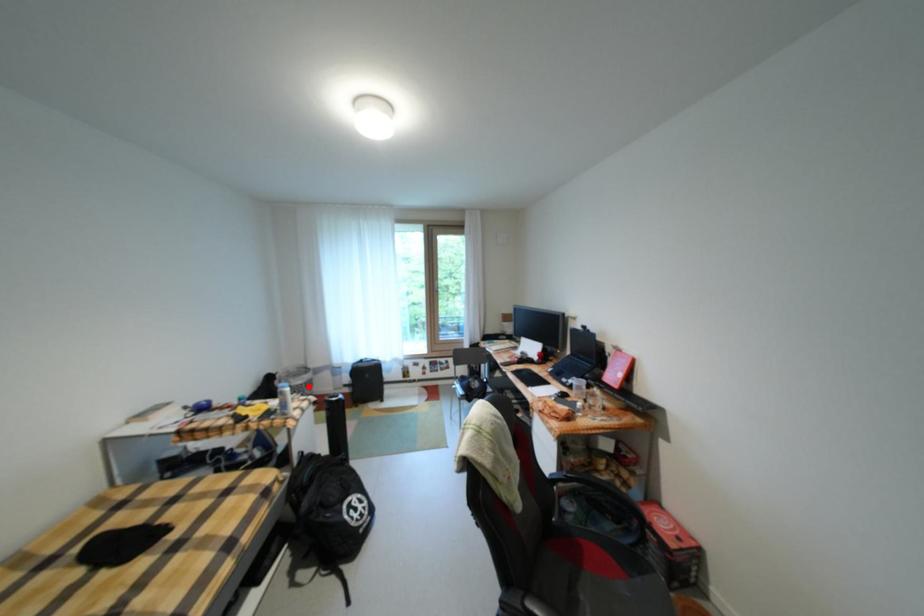
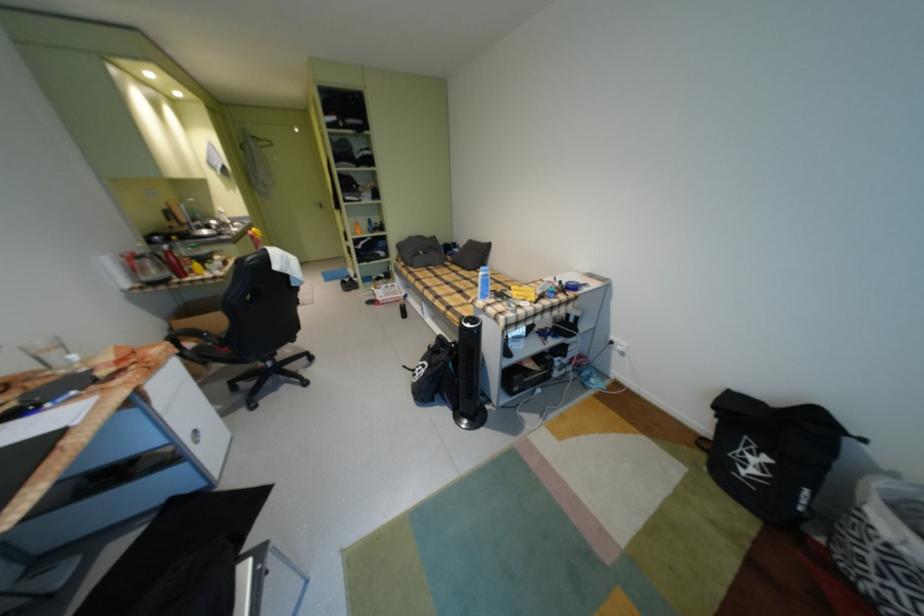
Question: I am providing you with two images of the same scene from different viewpoints. Given a red point in image1, look at the same physical point in image2. Is it:

Choices:
 (A) Closer to the viewpoint
 (B) Farther from the viewpoint

Answer: (B)